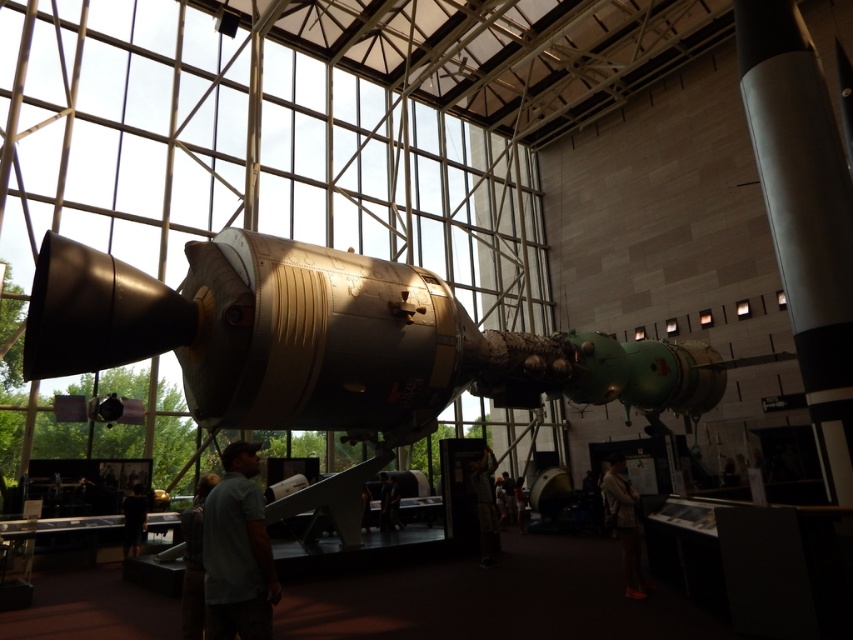
You are a visitor in the museum and want to take a photo of the shiny metallic rocket at right without the gray cotton shirt at lower left appearing in the frame. Which direction should you move to achieve this?

Move to the right of the shiny metallic rocket at right so that the gray cotton shirt at lower left is out of the frame.

You are a security guard in the museum and want to monitor the gray cotton shirt at lower left. Where should you position yourself to have a clear view of it?

You should position yourself near the large glass windows on the side of the room to have a clear view of the gray cotton shirt at lower left, as it is located at point (236, 552) in the image.